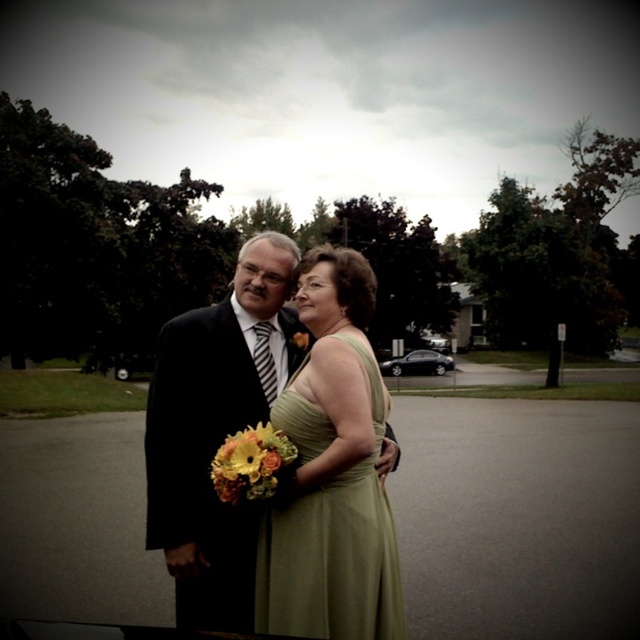
Question: Can you confirm if matte black suit at center is positioned above yellow fabric flower at center?

Choices:
 (A) no
 (B) yes

Answer: (A)

Question: Considering the real-world distances, which object is farthest from the vibrant floral bouquet at center?

Choices:
 (A) matte black suit at center
 (B) yellow fabric flower at center

Answer: (B)

Question: Considering the real-world distances, which object is farthest from the green satin dress at center?

Choices:
 (A) matte black suit at center
 (B) vibrant floral bouquet at center

Answer: (A)

Question: Which point is closer to the camera?

Choices:
 (A) green satin dress at center
 (B) matte black suit at center

Answer: (A)

Question: Is the position of green satin dress at center less distant than that of matte black suit at center?

Choices:
 (A) no
 (B) yes

Answer: (B)

Question: Is vibrant floral bouquet at center below yellow fabric flower at center?

Choices:
 (A) yes
 (B) no

Answer: (A)